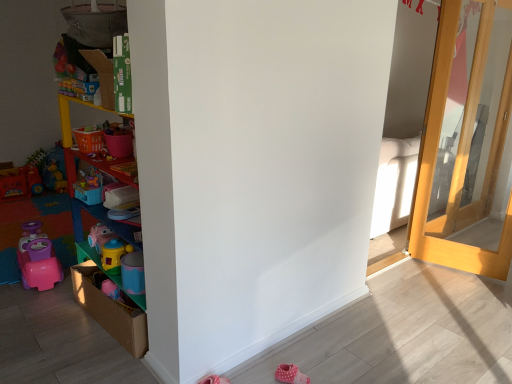
Question: From the image's perspective, is multicolored plastic shelves at left positioned above or below pink fabric shoe at lower right?

Choices:
 (A) above
 (B) below

Answer: (A)

Question: Considering the positions of point click(136, 238) and point click(293, 382), is point click(136, 238) closer or farther from the camera than point click(293, 382)?

Choices:
 (A) closer
 (B) farther

Answer: (B)

Question: Which is farther from the multicolored plastic shelves at left?

Choices:
 (A) light wood door at right
 (B) pink fabric shoe at lower right

Answer: (A)

Question: Which of these objects is positioned closest to the multicolored plastic shelves at left?

Choices:
 (A) light wood door at right
 (B) pink fabric shoe at lower right

Answer: (B)